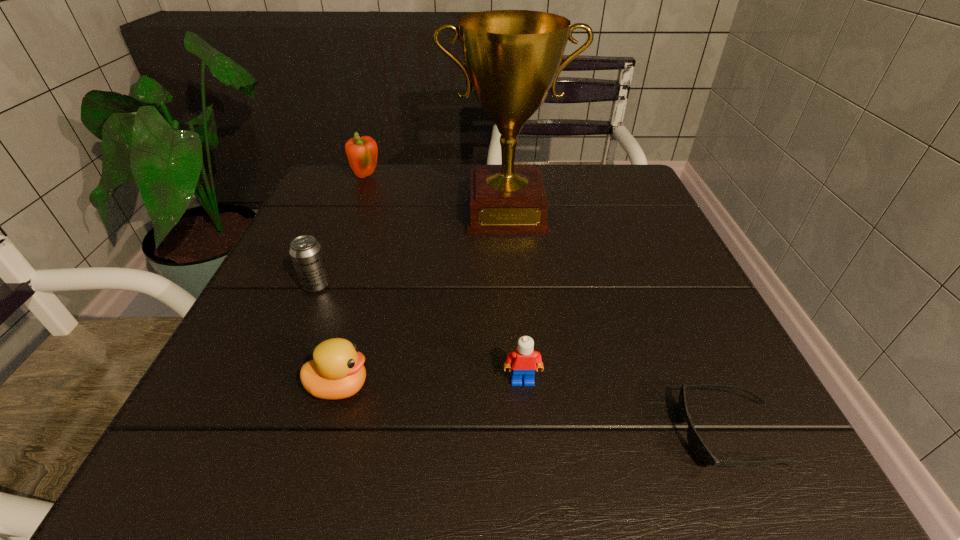
In the image, there is a desktop. Identify the location of free space at the far right corner. The height and width of the screenshot is (540, 960). (648, 208).

This screenshot has width=960, height=540. Identify the location of blank region between the award and the rightmost object. (617, 323).

You are a GUI agent. You are given a task and a screenshot of the screen. Output one action in this format:
    pyautogui.click(x=<x>, y=<y>)
    Task: Click on the unoccupied area between the rightmost object and the fifth nearest object
    This screenshot has width=960, height=540.
    Given the screenshot: What is the action you would take?
    pyautogui.click(x=617, y=323)

The image size is (960, 540). I want to click on vacant area that lies between the sunglasses and the tallest object, so click(x=617, y=323).

The height and width of the screenshot is (540, 960). In order to click on vacant point located between the fifth shortest object and the fifth nearest object in this screenshot , I will do `click(436, 195)`.

Locate an element on the screen. The height and width of the screenshot is (540, 960). vacant area between the second tallest object and the shortest object is located at coordinates (548, 306).

Locate an element on the screen. free space between the award and the sunglasses is located at coordinates coord(617,323).

Find the location of `free spot between the shortest object and the farthest object`. free spot between the shortest object and the farthest object is located at coordinates (x=548, y=306).

Where is `vacant space that is in between the Lego and the duckling`? vacant space that is in between the Lego and the duckling is located at coordinates (431, 383).

Identify the location of free space between the award and the Lego. The image size is (960, 540). (514, 296).